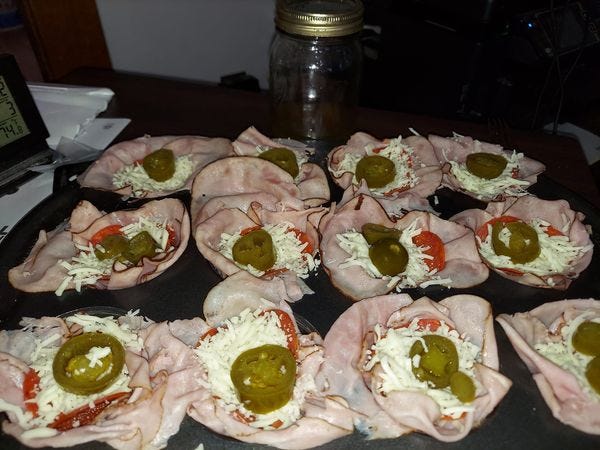
The width and height of the screenshot is (600, 450). In order to click on glass mason jar in this screenshot , I will do `click(311, 78)`.